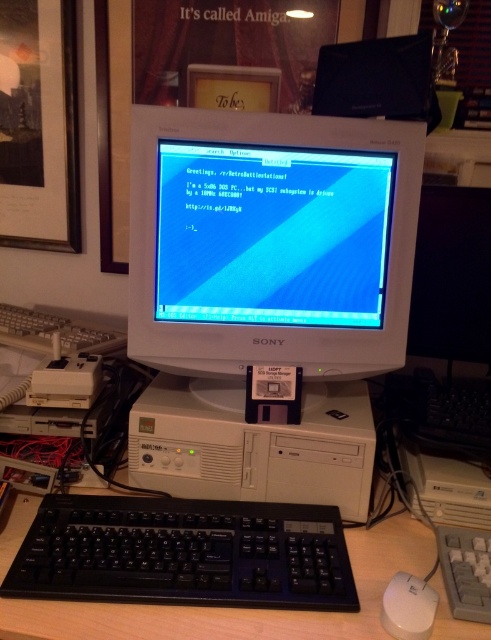
Question: Can you confirm if white plastic monitor at upper center is positioned above white plastic mouse at lower right?

Choices:
 (A) yes
 (B) no

Answer: (A)

Question: Which object appears farthest from the camera in this image?

Choices:
 (A) black plastic monitor at upper center
 (B) white plastic computer at center
 (C) white plastic monitor at upper center
 (D) black plastic keyboard at lower center

Answer: (C)

Question: Can you confirm if black plastic monitor at upper center is positioned below white plastic mouse at lower right?

Choices:
 (A) no
 (B) yes

Answer: (A)

Question: Can you confirm if white plastic monitor at center is positioned above white plastic mouse at lower right?

Choices:
 (A) yes
 (B) no

Answer: (A)

Question: Estimate the real-world distances between objects in this image. Which object is closer to the white plastic mouse at lower right?

Choices:
 (A) white plastic computer at center
 (B) white plastic monitor at upper center
 (C) white plastic monitor at center
 (D) black plastic monitor at upper center

Answer: (A)

Question: Which object is the closest to the white plastic computer at center?

Choices:
 (A) white plastic mouse at lower right
 (B) white plastic monitor at center
 (C) white plastic monitor at upper center

Answer: (B)